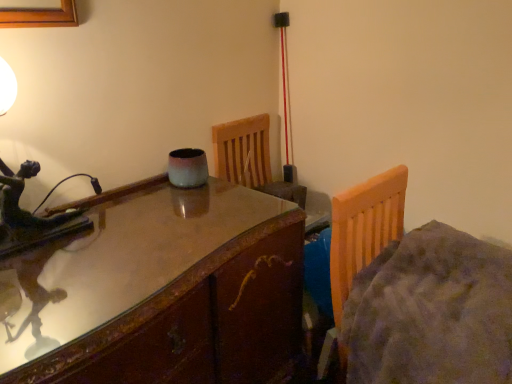
What do you see at coordinates (417, 294) in the screenshot?
I see `fuzzy gray bed at right` at bounding box center [417, 294].

At what (x,y) coordinates should I click in order to perform the action: click on fuzzy gray bed at right. Please return your answer as a coordinate pair (x, y). The image size is (512, 384). Looking at the image, I should click on (417, 294).

In order to click on glossy wood table at center in this screenshot , I will do `click(160, 293)`.

The image size is (512, 384). What do you see at coordinates (160, 293) in the screenshot? I see `glossy wood table at center` at bounding box center [160, 293].

Identify the location of fuzzy gray bed at right. (417, 294).

Which is more to the left, fuzzy gray bed at right or glossy wood table at center?

glossy wood table at center.

Which is behind, fuzzy gray bed at right or glossy wood table at center?

Positioned behind is fuzzy gray bed at right.

Between point (506, 382) and point (204, 340), which one is positioned in front?

The point (506, 382) is closer.

Looking at this image, from the image's perspective, relative to glossy wood table at center, is fuzzy gray bed at right above or below?

Clearly, from the image's perspective, fuzzy gray bed at right is above glossy wood table at center.

From a real-world perspective, is fuzzy gray bed at right located beneath glossy wood table at center?

Incorrect, from a real-world perspective, fuzzy gray bed at right is higher than glossy wood table at center.

Can you confirm if fuzzy gray bed at right is wider than glossy wood table at center?

No.

Considering the sizes of objects fuzzy gray bed at right and glossy wood table at center in the image provided, who is taller, fuzzy gray bed at right or glossy wood table at center?

glossy wood table at center.

Is fuzzy gray bed at right smaller than glossy wood table at center?

Yes, fuzzy gray bed at right is smaller than glossy wood table at center.

Is glossy wood table at center completely or partially inside fuzzy gray bed at right?

No, glossy wood table at center is not a part of fuzzy gray bed at right.

Is fuzzy gray bed at right in contact with glossy wood table at center?

fuzzy gray bed at right and glossy wood table at center are not in contact.

Is fuzzy gray bed at right positioned with its back to glossy wood table at center?

Yes, fuzzy gray bed at right is positioned with its back facing glossy wood table at center.

Find the location of a particular element. This screenshot has width=512, height=384. table that appears on the left of fuzzy gray bed at right is located at coordinates (160, 293).

Considering the positions of objects glossy wood table at center and fuzzy gray bed at right in the image provided, who is more to the left, glossy wood table at center or fuzzy gray bed at right?

From the viewer's perspective, glossy wood table at center appears more on the left side.

Is the position of glossy wood table at center more distant than that of fuzzy gray bed at right?

No.

Does point (231, 329) come closer to viewer compared to point (398, 215)?

Yes, point (231, 329) is in front of point (398, 215).

From the image's perspective, is glossy wood table at center over fuzzy gray bed at right?

No, from the image's perspective, glossy wood table at center is not on top of fuzzy gray bed at right.

From a real-world perspective, who is located higher, glossy wood table at center or fuzzy gray bed at right?

fuzzy gray bed at right.

Is glossy wood table at center wider or thinner than fuzzy gray bed at right?

Considering their sizes, glossy wood table at center looks broader than fuzzy gray bed at right.

Which of these two, glossy wood table at center or fuzzy gray bed at right, stands shorter?

fuzzy gray bed at right.

Considering the relative sizes of glossy wood table at center and fuzzy gray bed at right in the image provided, is glossy wood table at center bigger than fuzzy gray bed at right?

Yes.

Is glossy wood table at center located outside fuzzy gray bed at right?

That's correct, glossy wood table at center is outside of fuzzy gray bed at right.

Are glossy wood table at center and fuzzy gray bed at right far apart?

That's not correct — glossy wood table at center is a little close to fuzzy gray bed at right.

In the scene shown: Does glossy wood table at center turn towards fuzzy gray bed at right?

Yes, glossy wood table at center is oriented towards fuzzy gray bed at right.

I want to click on bed on the right of glossy wood table at center, so click(417, 294).

The image size is (512, 384). I want to click on bed behind the glossy wood table at center, so click(417, 294).

Locate an element on the screen. The image size is (512, 384). table that is under the fuzzy gray bed at right (from a real-world perspective) is located at coordinates (160, 293).